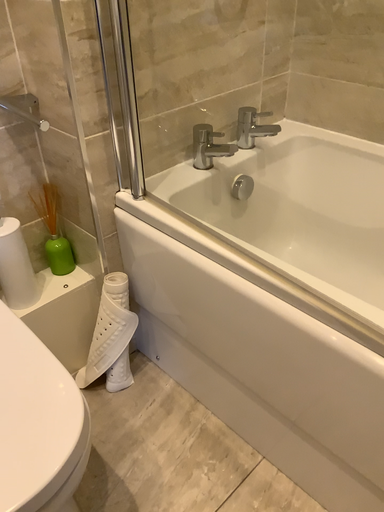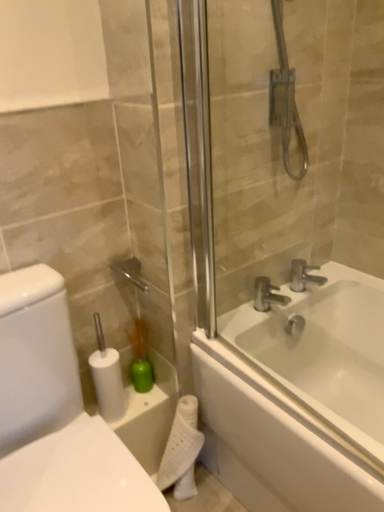
Question: Which way did the camera rotate in the video?

Choices:
 (A) rotated left
 (B) rotated right

Answer: (A)